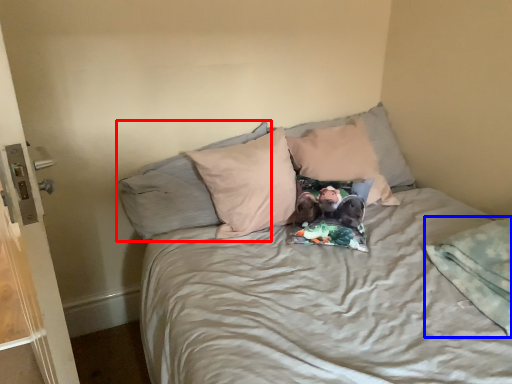
Question: Which point is closer to the camera, pillow (highlighted by a red box) or blanket (highlighted by a blue box)?

Choices:
 (A) pillow
 (B) blanket

Answer: (B)